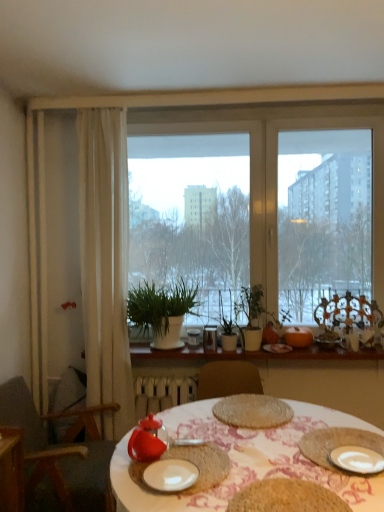
You are a GUI agent. You are given a task and a screenshot of the screen. Output one action in this format:
    pyautogui.click(x=<x>, y=<y>)
    Task: Click on the free space in front of transparent glass teapot at lower left, arranged as the first tableware when viewed from the left
    
    Given the screenshot: What is the action you would take?
    pyautogui.click(x=141, y=484)